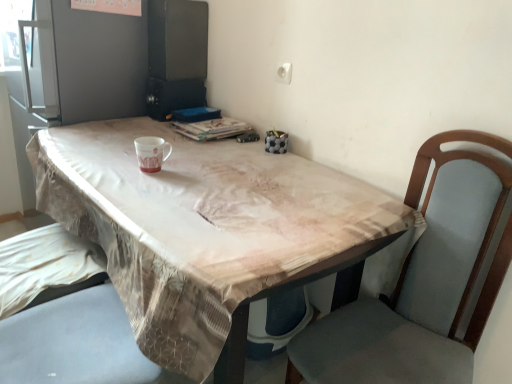
Question: From the image's perspective, is brown fabric table at center positioned above or below matte ceramic mug at center?

Choices:
 (A) above
 (B) below

Answer: (B)

Question: Is brown fabric table at center in front of or behind matte ceramic mug at center in the image?

Choices:
 (A) front
 (B) behind

Answer: (A)

Question: From their relative heights in the image, would you say brown fabric table at center is taller or shorter than matte ceramic mug at center?

Choices:
 (A) short
 (B) tall

Answer: (B)

Question: Considering the positions of matte ceramic mug at center and brown fabric table at center in the image, is matte ceramic mug at center wider or thinner than brown fabric table at center?

Choices:
 (A) thin
 (B) wide

Answer: (A)

Question: Visually, is matte ceramic mug at center positioned to the left or to the right of brown fabric table at center?

Choices:
 (A) left
 (B) right

Answer: (A)

Question: From a real-world perspective, is matte ceramic mug at center physically located above or below brown fabric table at center?

Choices:
 (A) below
 (B) above

Answer: (B)

Question: Considering the positions of point (159, 170) and point (105, 142), is point (159, 170) closer or farther from the camera than point (105, 142)?

Choices:
 (A) closer
 (B) farther

Answer: (A)